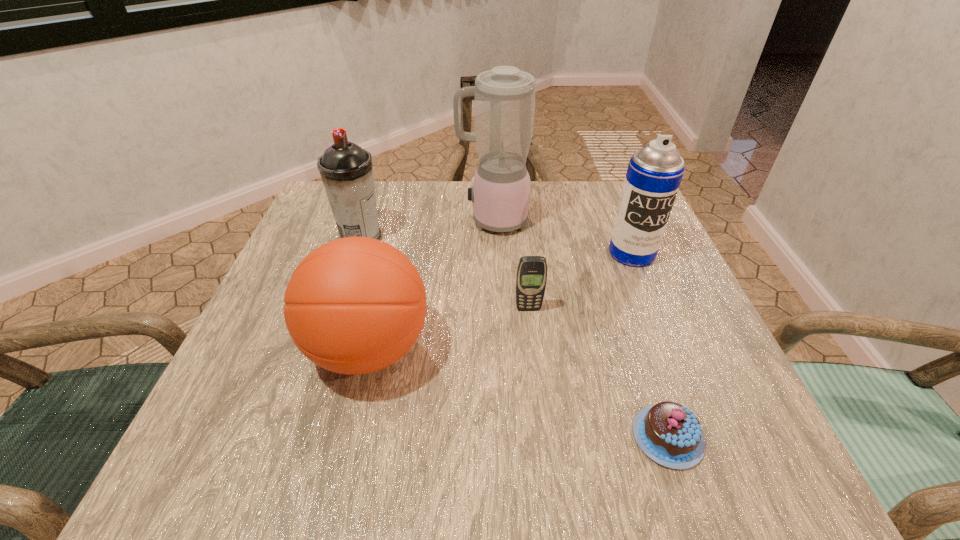
The width and height of the screenshot is (960, 540). I want to click on vacant space situated on the label side of the right aerosol can, so click(x=644, y=285).

The image size is (960, 540). I want to click on free space located on the front of the left aerosol can, so click(351, 267).

Where is `free space located on the back of the fourth tallest object`? The width and height of the screenshot is (960, 540). free space located on the back of the fourth tallest object is located at coordinates (390, 261).

Where is `free space located on the screen of the second shortest object`? The image size is (960, 540). free space located on the screen of the second shortest object is located at coordinates (540, 417).

Find the location of a particular element. The width and height of the screenshot is (960, 540). vacant space located 0.280m on the left of the chocolate cake is located at coordinates (441, 437).

Find the location of `food processor located at the far edge`. food processor located at the far edge is located at coordinates (504, 98).

This screenshot has height=540, width=960. I want to click on aerosol can situated at the far edge, so click(x=346, y=170).

The image size is (960, 540). Find the location of `object present at the near edge`. object present at the near edge is located at coordinates (670, 434).

You are a GUI agent. You are given a task and a screenshot of the screen. Output one action in this format:
    pyautogui.click(x=<x>, y=<y>)
    Task: Click on the aerosol can that is at the left edge
    
    Given the screenshot: What is the action you would take?
    pyautogui.click(x=346, y=170)

This screenshot has width=960, height=540. In order to click on basketball that is at the left edge in this screenshot , I will do `click(355, 305)`.